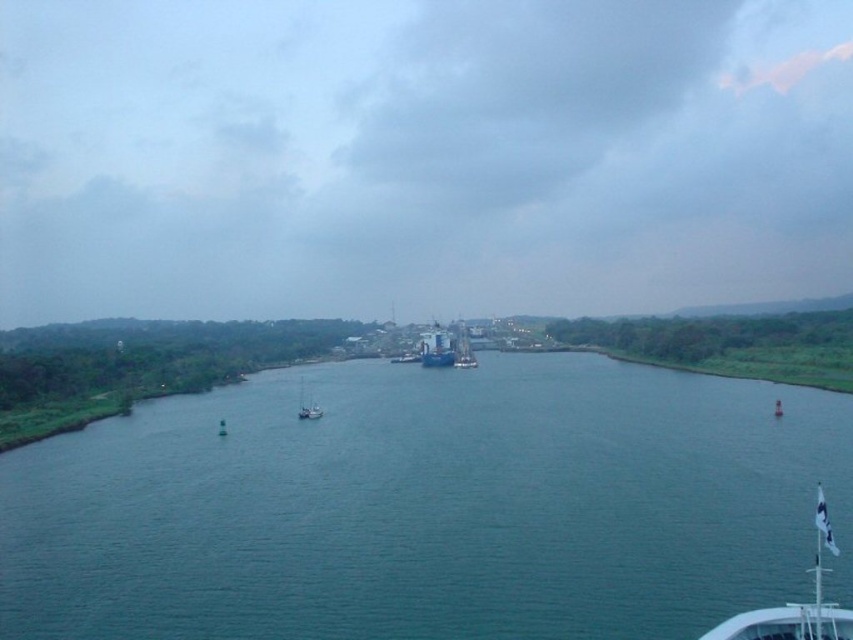
Is blue water at center further to camera compared to white matte sailboat at center?

No.

Between point (474, 528) and point (318, 413), which one is positioned behind?

Point (318, 413)

Who is more forward, (538, 381) or (297, 412)?

Positioned in front is point (297, 412).

Identify the location of blue water at center. This screenshot has width=853, height=640. (428, 506).

Does blue matte ship at center have a lesser width compared to white matte sailboat at center?

Yes, blue matte ship at center is thinner than white matte sailboat at center.

Does blue matte ship at center lie in front of white matte sailboat at center?

No, it is behind white matte sailboat at center.

Locate an element on the screen. blue matte ship at center is located at coordinates (463, 349).

Between point (514, 448) and point (422, 336), which one is positioned in front?

Point (514, 448)

Does point (508, 577) come closer to viewer compared to point (444, 342)?

Yes, it is.

At what (x,y) coordinates should I click in order to perform the action: click on blue water at center. Please return your answer as a coordinate pair (x, y). The image size is (853, 640). Looking at the image, I should click on (428, 506).